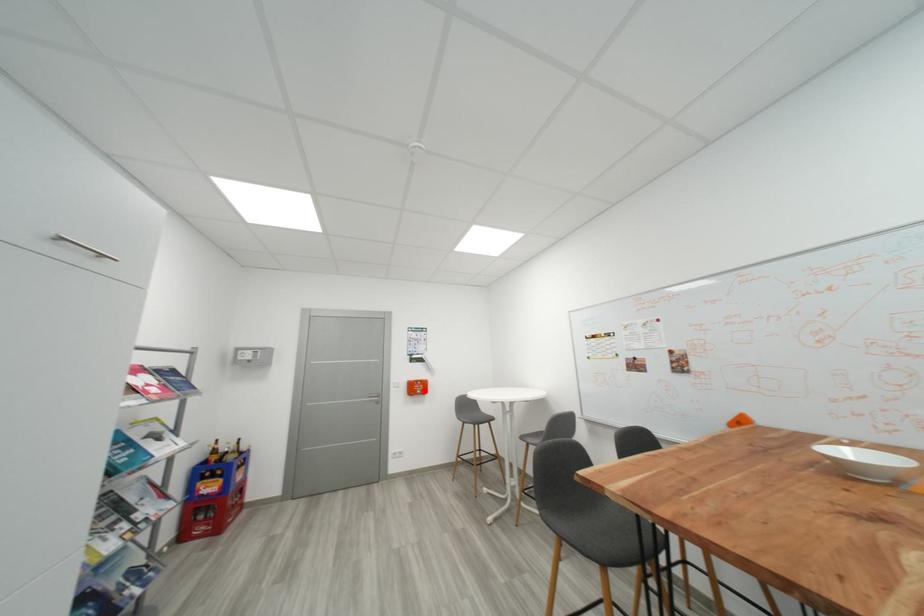
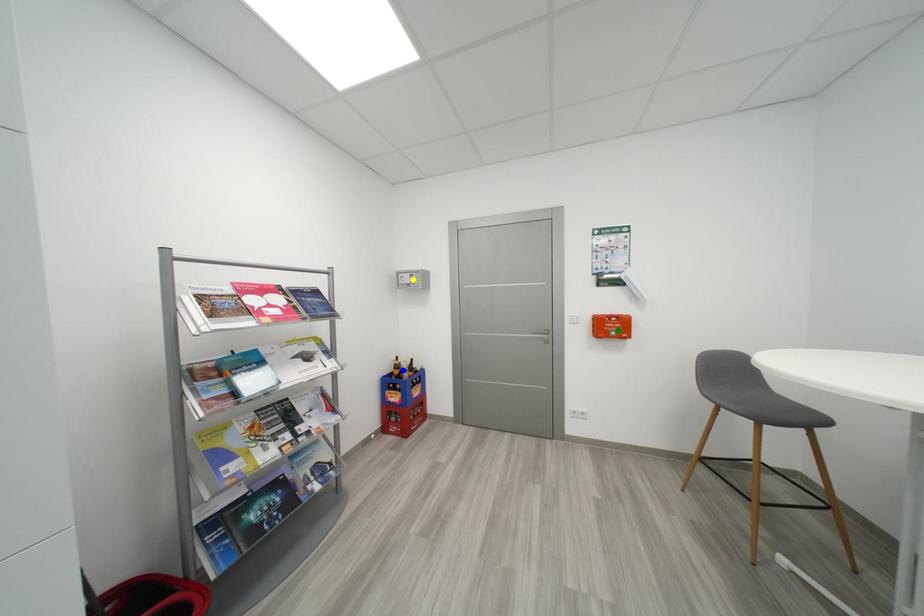
Question: I am providing you with two images of the same scene from different viewpoints. A red point is marked on the first image. You are given multiple points on the second image. In image 2, which mark is for the same physical point as the one in image 1?

Choices:
 (A) blue point
 (B) yellow point
 (C) green point

Answer: (C)